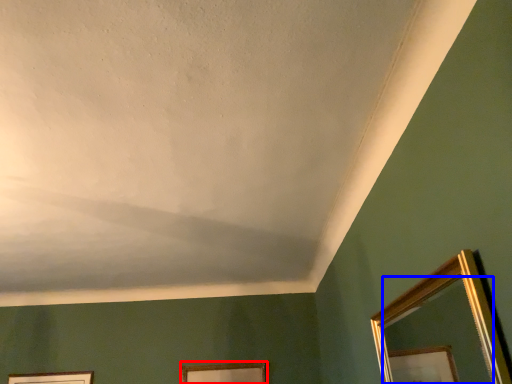
Question: Which of the following is the farthest to the observer, picture frame (highlighted by a red box) or mirror (highlighted by a blue box)?

Choices:
 (A) picture frame
 (B) mirror

Answer: (A)